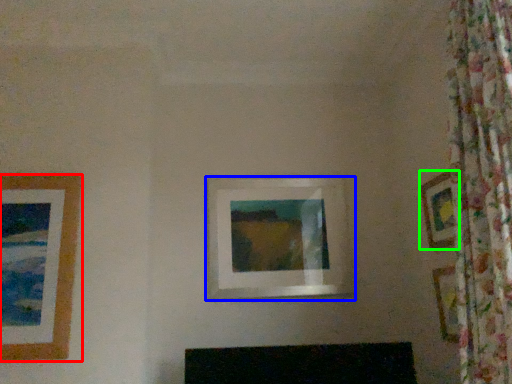
Question: Which object is the farthest from picture frame (highlighted by a red box)? Choose among these: picture frame (highlighted by a blue box) or picture frame (highlighted by a green box).

Choices:
 (A) picture frame
 (B) picture frame

Answer: (B)